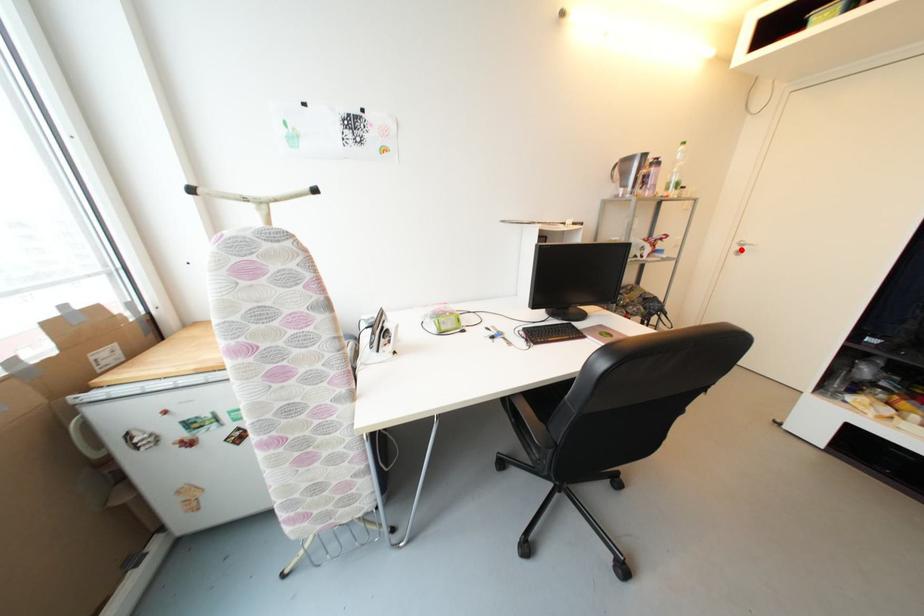
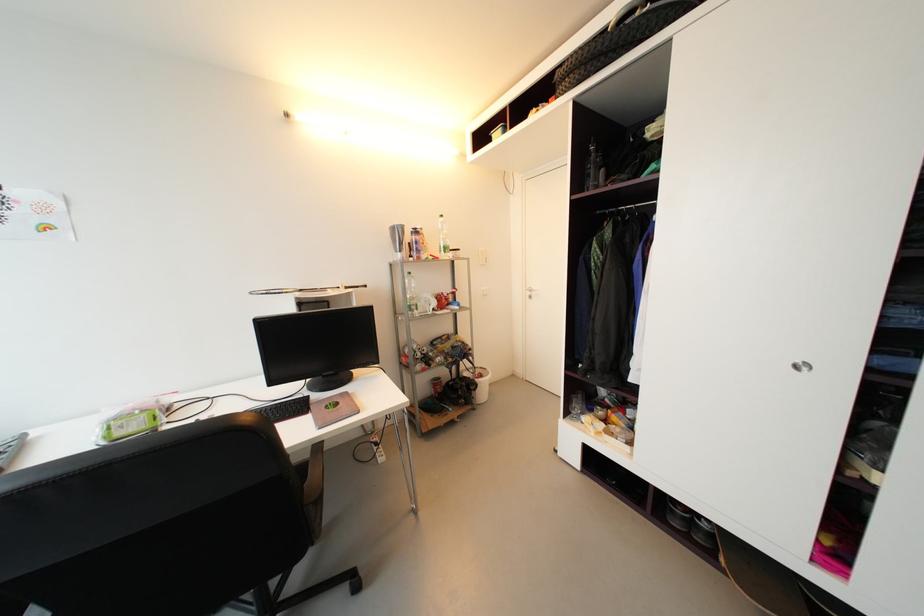
Locate, in the second image, the point that corresponds to the highlighted location in the first image.

(533, 294)